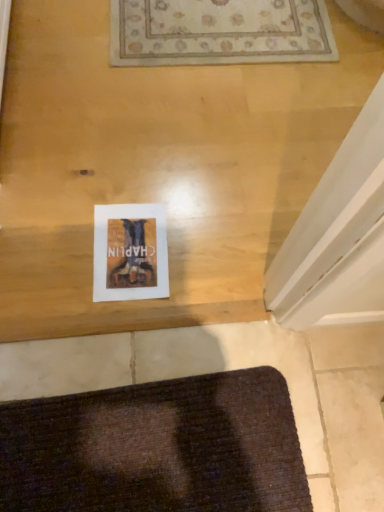
You are a GUI agent. You are given a task and a screenshot of the screen. Output one action in this format:
    pyautogui.click(x=<x>, y=<y>)
    Task: Click on the blank space above dark brown textured mat at lower left (from a real-world perspective)
    Image resolution: width=384 pixels, height=512 pixels.
    Given the screenshot: What is the action you would take?
    pyautogui.click(x=148, y=446)